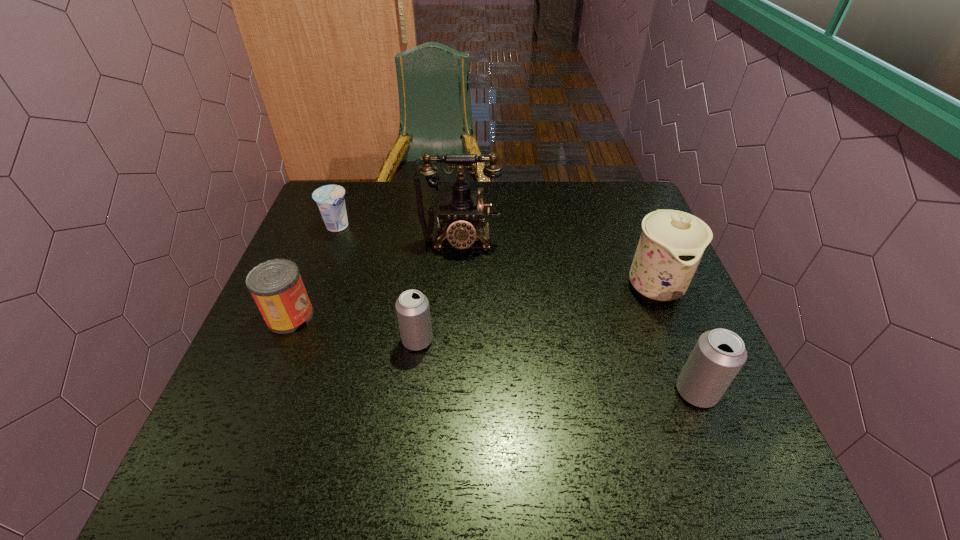
Locate an element on the screen. The height and width of the screenshot is (540, 960). free region located on the right of the can is located at coordinates (455, 316).

Find the location of a particular element. The width and height of the screenshot is (960, 540). vacant space situated 0.400m on the front of the shortest object is located at coordinates (290, 350).

You are a GUI agent. You are given a task and a screenshot of the screen. Output one action in this format:
    pyautogui.click(x=<x>, y=<y>)
    Task: Click on the free location located on the spout of the fifth shortest object
    The image size is (960, 540).
    Given the screenshot: What is the action you would take?
    pyautogui.click(x=702, y=404)

The width and height of the screenshot is (960, 540). I want to click on blank space located on the rotary dial of the telephone, so click(454, 348).

Where is `yogurt located at the far edge`? This screenshot has width=960, height=540. yogurt located at the far edge is located at coordinates (330, 199).

Image resolution: width=960 pixels, height=540 pixels. I want to click on telephone located in the far edge section of the desktop, so click(x=461, y=209).

This screenshot has width=960, height=540. Identify the location of object at the near edge. (719, 354).

Where is `can present at the left edge`? Image resolution: width=960 pixels, height=540 pixels. can present at the left edge is located at coordinates (276, 285).

Locate an element on the screen. yogurt present at the left edge is located at coordinates (330, 199).

Identify the location of beer can that is positioned at the right edge. (719, 354).